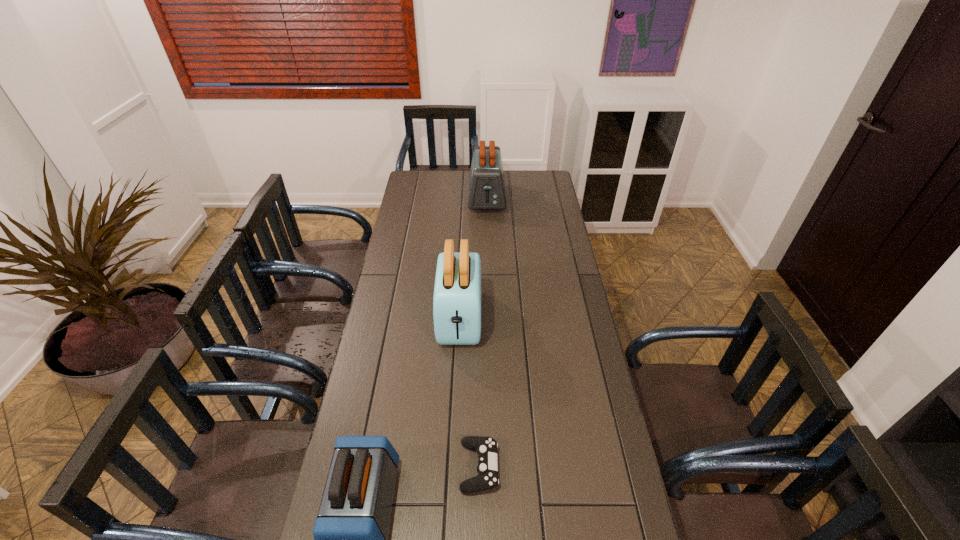
Where is `the second farthest toaster`? The height and width of the screenshot is (540, 960). the second farthest toaster is located at coordinates (457, 292).

Locate an element on the screen. Image resolution: width=960 pixels, height=540 pixels. the farthest toaster is located at coordinates (486, 190).

At what (x,y) coordinates should I click in order to perform the action: click on control. Please return your answer as a coordinate pair (x, y). The image size is (960, 540). Looking at the image, I should click on click(x=486, y=447).

Locate an element on the screen. free region located 0.270m on the side of the second farthest object with the lever is located at coordinates (455, 424).

Find the location of a particular element. vacant position located 0.230m on the front-facing side of the farthest toaster is located at coordinates (488, 246).

Where is `free space located 0.320m on the surface of the shortest object`? The height and width of the screenshot is (540, 960). free space located 0.320m on the surface of the shortest object is located at coordinates (613, 467).

Locate an element on the screen. Image resolution: width=960 pixels, height=540 pixels. object that is at the far edge is located at coordinates (486, 190).

Where is `vacant space at the left edge of the desktop`? The width and height of the screenshot is (960, 540). vacant space at the left edge of the desktop is located at coordinates (399, 349).

Find the location of a particular element. free space at the right edge is located at coordinates (553, 357).

Locate an element on the screen. This screenshot has width=960, height=540. vacant space at the far right corner is located at coordinates (547, 173).